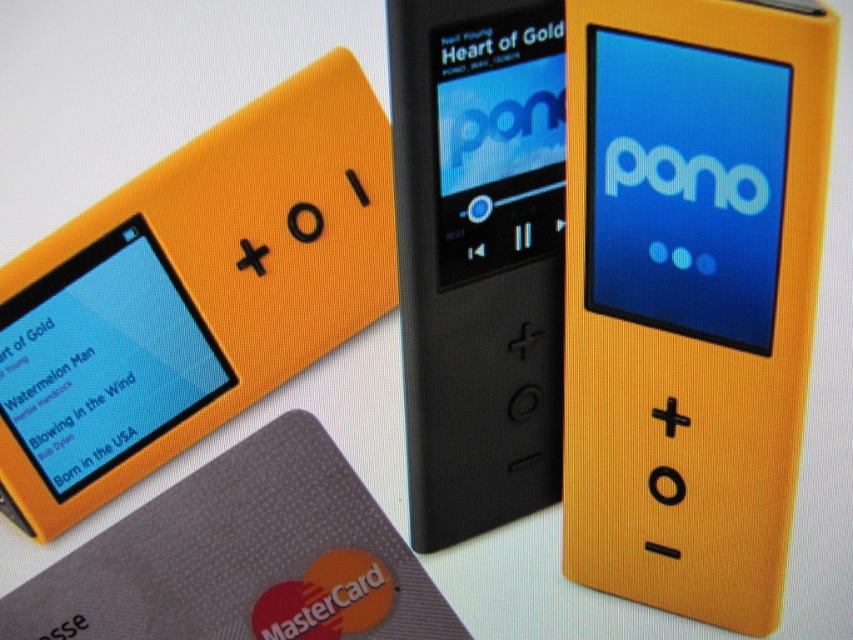
Question: Which object is the closest to the black matte mp3 player at center?

Choices:
 (A) orange matte plastic pono at upper left
 (B) orange matte ipod at center

Answer: (B)

Question: Does orange matte ipod at center come behind orange matte plastic pono at upper left?

Choices:
 (A) no
 (B) yes

Answer: (A)

Question: Can you confirm if orange matte ipod at center is positioned to the right of orange matte plastic pono at upper left?

Choices:
 (A) no
 (B) yes

Answer: (B)

Question: Among these objects, which one is farthest from the camera?

Choices:
 (A) orange matte ipod at center
 (B) orange matte plastic pono at upper left

Answer: (B)

Question: Observing the image, what is the correct spatial positioning of orange matte plastic pono at upper left in reference to black matte mp3 player at center?

Choices:
 (A) left
 (B) right

Answer: (A)

Question: Which point is closer to the camera?

Choices:
 (A) orange matte plastic pono at upper left
 (B) orange matte ipod at center

Answer: (B)